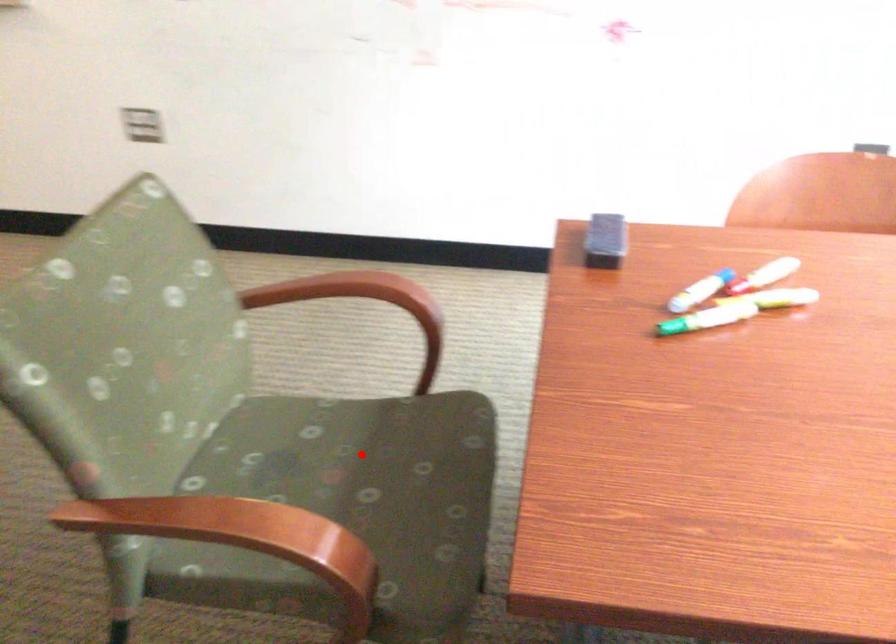
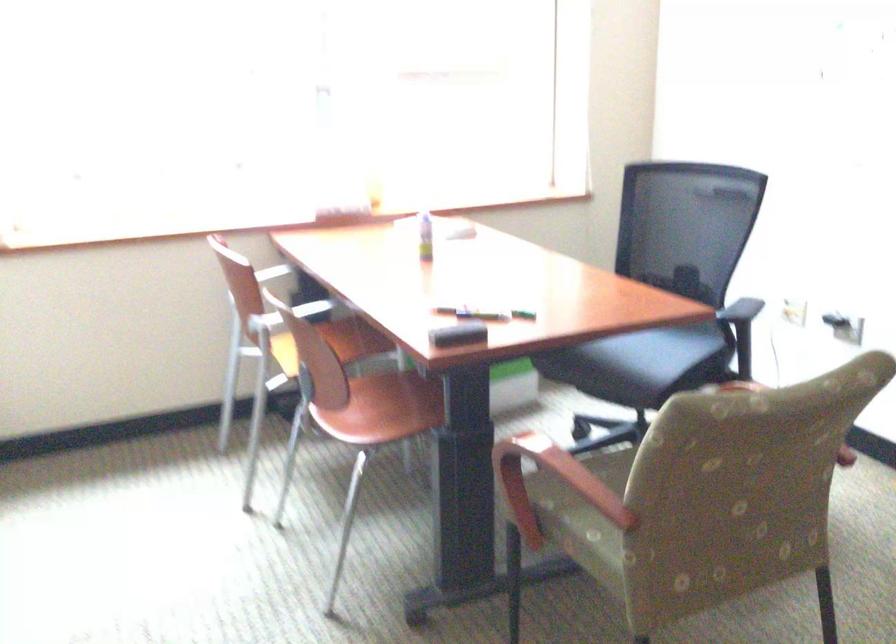
Question: I am providing you with two images of the same scene from different viewpoints. A red point is marked on the first image. Is the red point's position out of view in image 2?

Choices:
 (A) Yes
 (B) No

Answer: (A)